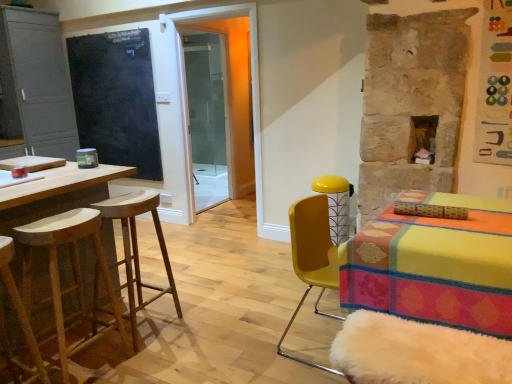
This screenshot has height=384, width=512. I want to click on free space above black chalkboard at left (from a real-world perspective), so click(113, 31).